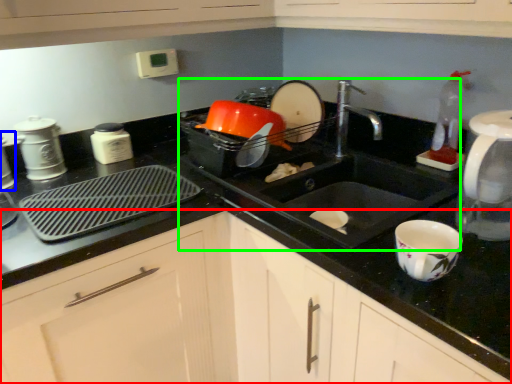
Question: Which object is positioned farthest from cabinetry (highlighted by a red box)? Select from appliance (highlighted by a blue box) and sink (highlighted by a green box).

Choices:
 (A) appliance
 (B) sink

Answer: (A)